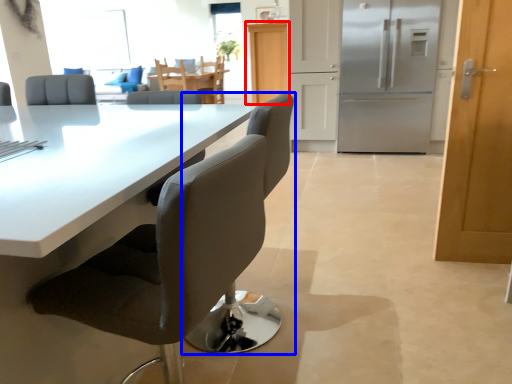
Question: Which point is further to the camera, cabinetry (highlighted by a red box) or chair (highlighted by a blue box)?

Choices:
 (A) cabinetry
 (B) chair

Answer: (A)